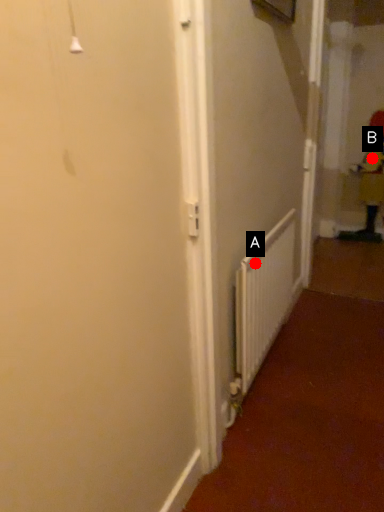
Question: Two points are circled on the image, labeled by A and B beside each circle. Which point is closer to the camera?

Choices:
 (A) A is closer
 (B) B is closer

Answer: (A)